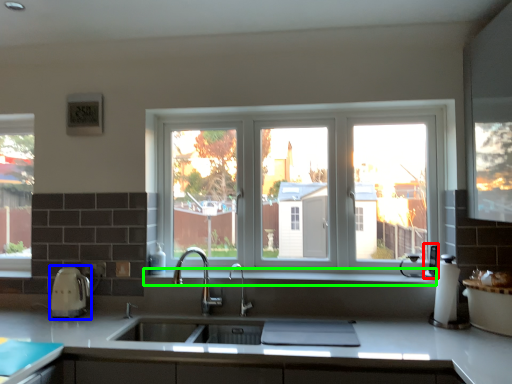
Question: Estimate the real-world distances between objects in this image. Which object is farther from appliance (highlighted by a red box), appliance (highlighted by a blue box) or window sill (highlighted by a green box)?

Choices:
 (A) appliance
 (B) window sill

Answer: (A)